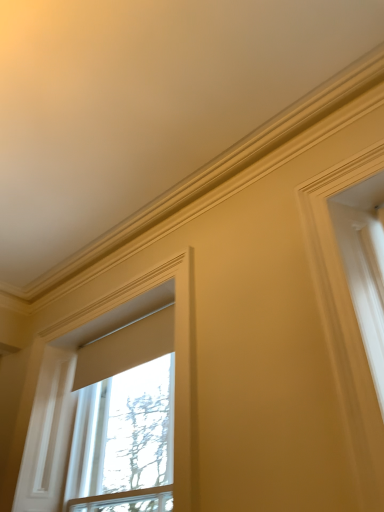
Find the location of a particular element. This screenshot has height=512, width=384. matte white shade at upper left, which is counted as the 2th window, starting from the right is located at coordinates (71, 380).

What do you see at coordinates (71, 380) in the screenshot? I see `matte white shade at upper left, which is counted as the 2th window, starting from the right` at bounding box center [71, 380].

How much space does matte white shade at upper left, which is counted as the 2th window, starting from the right, occupy vertically?

The height of matte white shade at upper left, which is counted as the 2th window, starting from the right, is 1.35 meters.

I want to click on matte beige window at center, which ranks as the 1th window in right-to-left order, so click(x=123, y=438).

How much space does matte beige window at center, which ranks as the 1th window in right-to-left order, occupy horizontally?

6.49 inches.

Describe the element at coordinates (123, 438) in the screenshot. I see `matte beige window at center, which ranks as the 2th window in left-to-right order` at that location.

This screenshot has height=512, width=384. Identify the location of matte white shade at upper left, which is counted as the 2th window, starting from the right. (71, 380).

Does matte white shade at upper left, which is counted as the 2th window, starting from the right, appear on the right side of matte beige window at center, which ranks as the 2th window in left-to-right order?

No, matte white shade at upper left, which is counted as the 2th window, starting from the right, is not to the right of matte beige window at center, which ranks as the 2th window in left-to-right order.

Is the depth of matte white shade at upper left, which is the first window from left to right, greater than that of matte beige window at center, which ranks as the 2th window in left-to-right order?

No, it is in front of matte beige window at center, which ranks as the 2th window in left-to-right order.

Which is in front, point (194, 391) or point (97, 507)?

The point (194, 391) is closer to the camera.

From the image's perspective, does matte white shade at upper left, which is counted as the 2th window, starting from the right, appear higher than matte beige window at center, which ranks as the 2th window in left-to-right order?

Yes, from the image's perspective, matte white shade at upper left, which is counted as the 2th window, starting from the right, is over matte beige window at center, which ranks as the 2th window in left-to-right order.

From a real-world perspective, is matte white shade at upper left, which is counted as the 2th window, starting from the right, over matte beige window at center, which ranks as the 1th window in right-to-left order?

Yes.

Considering the relative sizes of matte white shade at upper left, which is counted as the 2th window, starting from the right, and matte beige window at center, which ranks as the 1th window in right-to-left order, in the image provided, is matte white shade at upper left, which is counted as the 2th window, starting from the right, wider than matte beige window at center, which ranks as the 1th window in right-to-left order,?

No.

Considering the sizes of objects matte white shade at upper left, which is the first window from left to right, and matte beige window at center, which ranks as the 1th window in right-to-left order, in the image provided, who is shorter, matte white shade at upper left, which is the first window from left to right, or matte beige window at center, which ranks as the 1th window in right-to-left order,?

matte beige window at center, which ranks as the 1th window in right-to-left order.

Does matte white shade at upper left, which is the first window from left to right, have a larger size compared to matte beige window at center, which ranks as the 1th window in right-to-left order?

No, matte white shade at upper left, which is the first window from left to right, is not bigger than matte beige window at center, which ranks as the 1th window in right-to-left order.

Choose the correct answer: Is matte white shade at upper left, which is counted as the 2th window, starting from the right, inside matte beige window at center, which ranks as the 2th window in left-to-right order, or outside it?

matte white shade at upper left, which is counted as the 2th window, starting from the right, is outside matte beige window at center, which ranks as the 2th window in left-to-right order.

Is matte white shade at upper left, which is the first window from left to right, next to matte beige window at center, which ranks as the 1th window in right-to-left order, and touching it?

matte white shade at upper left, which is the first window from left to right, and matte beige window at center, which ranks as the 1th window in right-to-left order, are not in contact.

Is matte white shade at upper left, which is the first window from left to right, looking in the opposite direction of matte beige window at center, which ranks as the 1th window in right-to-left order?

Yes, matte white shade at upper left, which is the first window from left to right,'s orientation is away from matte beige window at center, which ranks as the 1th window in right-to-left order.

How many degrees apart are the facing directions of matte white shade at upper left, which is counted as the 2th window, starting from the right, and matte beige window at center, which ranks as the 1th window in right-to-left order?

0.931 degrees separate the facing orientations of matte white shade at upper left, which is counted as the 2th window, starting from the right, and matte beige window at center, which ranks as the 1th window in right-to-left order.

Could you measure the distance between matte white shade at upper left, which is counted as the 2th window, starting from the right, and matte beige window at center, which ranks as the 1th window in right-to-left order?

A distance of 28.07 centimeters exists between matte white shade at upper left, which is counted as the 2th window, starting from the right, and matte beige window at center, which ranks as the 1th window in right-to-left order.

Locate an element on the screen. This screenshot has width=384, height=512. window below the matte white shade at upper left, which is the first window from left to right (from a real-world perspective) is located at coordinates (123, 438).

Would you say matte beige window at center, which ranks as the 2th window in left-to-right order, is to the left or to the right of matte white shade at upper left, which is counted as the 2th window, starting from the right, in the picture?

matte beige window at center, which ranks as the 2th window in left-to-right order, is positioned on matte white shade at upper left, which is counted as the 2th window, starting from the right,'s right side.

Which object is closer to the camera taking this photo, matte beige window at center, which ranks as the 1th window in right-to-left order, or matte white shade at upper left, which is the first window from left to right?

matte white shade at upper left, which is the first window from left to right, is closer to the camera.

Is point (90, 439) closer to camera compared to point (179, 407)?

No, (90, 439) is behind (179, 407).

From the image's perspective, is matte beige window at center, which ranks as the 2th window in left-to-right order, located above matte white shade at upper left, which is the first window from left to right?

No, from the image's perspective, matte beige window at center, which ranks as the 2th window in left-to-right order, is not on top of matte white shade at upper left, which is the first window from left to right.

From a real-world perspective, is matte beige window at center, which ranks as the 1th window in right-to-left order, beneath matte white shade at upper left, which is counted as the 2th window, starting from the right?

Indeed, from a real-world perspective, matte beige window at center, which ranks as the 1th window in right-to-left order, is positioned beneath matte white shade at upper left, which is counted as the 2th window, starting from the right.

Which object is wider, matte beige window at center, which ranks as the 2th window in left-to-right order, or matte white shade at upper left, which is the first window from left to right?

matte beige window at center, which ranks as the 2th window in left-to-right order, is wider.

Considering the sizes of matte beige window at center, which ranks as the 2th window in left-to-right order, and matte white shade at upper left, which is the first window from left to right, in the image, is matte beige window at center, which ranks as the 2th window in left-to-right order, taller or shorter than matte white shade at upper left, which is the first window from left to right,?

matte beige window at center, which ranks as the 2th window in left-to-right order, is shorter than matte white shade at upper left, which is the first window from left to right.

Considering the sizes of objects matte beige window at center, which ranks as the 2th window in left-to-right order, and matte white shade at upper left, which is the first window from left to right, in the image provided, who is smaller, matte beige window at center, which ranks as the 2th window in left-to-right order, or matte white shade at upper left, which is the first window from left to right,?

matte white shade at upper left, which is the first window from left to right, is smaller.

Is matte beige window at center, which ranks as the 1th window in right-to-left order, completely or partially outside of matte white shade at upper left, which is the first window from left to right?

That's correct, matte beige window at center, which ranks as the 1th window in right-to-left order, is outside of matte white shade at upper left, which is the first window from left to right.

Is matte beige window at center, which ranks as the 2th window in left-to-right order, placed right next to matte white shade at upper left, which is counted as the 2th window, starting from the right?

There is a gap between matte beige window at center, which ranks as the 2th window in left-to-right order, and matte white shade at upper left, which is counted as the 2th window, starting from the right.

Is matte beige window at center, which ranks as the 2th window in left-to-right order, positioned with its back to matte white shade at upper left, which is counted as the 2th window, starting from the right?

Yes, matte beige window at center, which ranks as the 2th window in left-to-right order, is positioned with its back facing matte white shade at upper left, which is counted as the 2th window, starting from the right.

Can you tell me how much matte beige window at center, which ranks as the 2th window in left-to-right order, and matte white shade at upper left, which is counted as the 2th window, starting from the right, differ in facing direction?

The facing directions of matte beige window at center, which ranks as the 2th window in left-to-right order, and matte white shade at upper left, which is counted as the 2th window, starting from the right, are 0.931 degrees apart.

How far apart are matte beige window at center, which ranks as the 1th window in right-to-left order, and matte white shade at upper left, which is the first window from left to right?

11.05 inches.

I want to click on window on the left of the matte beige window at center, which ranks as the 1th window in right-to-left order, so click(71, 380).

Locate an element on the screen. window on the right side of matte white shade at upper left, which is counted as the 2th window, starting from the right is located at coordinates (123, 438).

I want to click on window that appears behind the matte white shade at upper left, which is the first window from left to right, so click(123, 438).